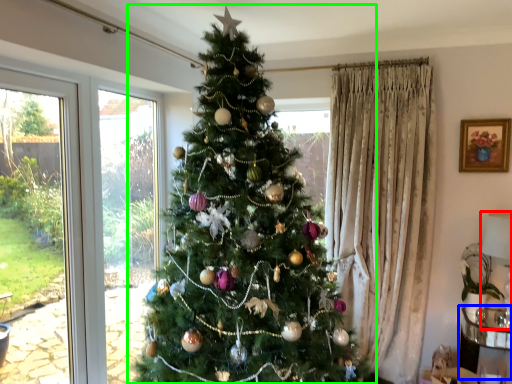
Question: Which object is the farthest from lamp (highlighted by a red box)? Choose among these: furniture (highlighted by a blue box) or christmas tree (highlighted by a green box).

Choices:
 (A) furniture
 (B) christmas tree

Answer: (B)